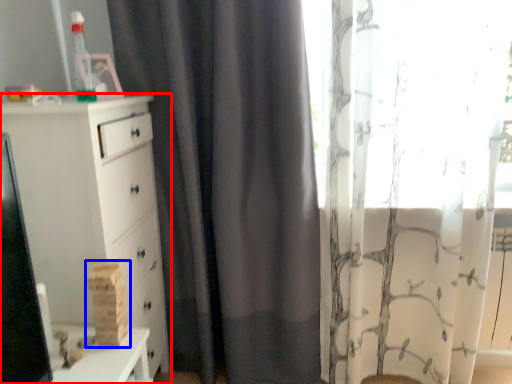
Question: Which object appears farthest to the camera in this image, chest of drawers (highlighted by a red box) or toy (highlighted by a blue box)?

Choices:
 (A) chest of drawers
 (B) toy

Answer: (B)